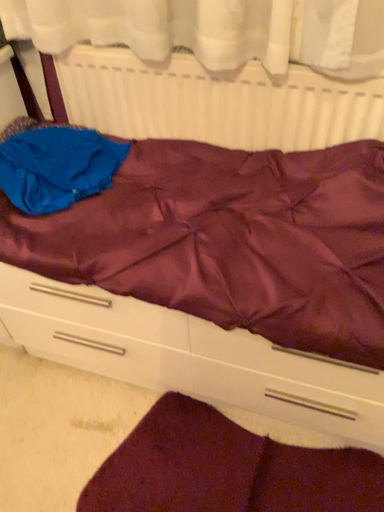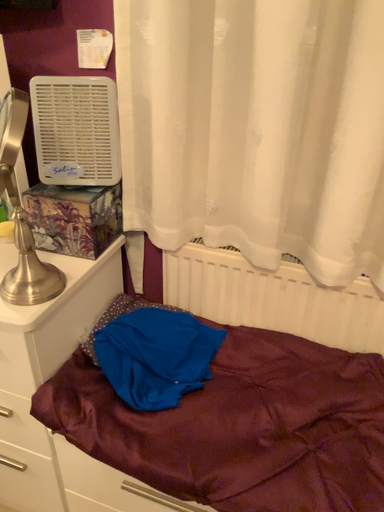
Question: Which way did the camera rotate in the video?

Choices:
 (A) rotated downward
 (B) rotated upward

Answer: (B)